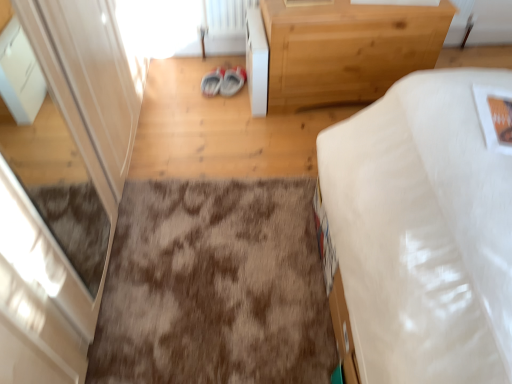
I want to click on brown shaggy rug at center, so click(214, 287).

What do you see at coordinates (93, 77) in the screenshot?
I see `white glossy screen door at left` at bounding box center [93, 77].

What do you see at coordinates (346, 49) in the screenshot?
I see `light wood/texture chest of drawers at upper right` at bounding box center [346, 49].

The width and height of the screenshot is (512, 384). I want to click on light wood/texture chest of drawers at upper right, so click(346, 49).

Describe the element at coordinates (256, 61) in the screenshot. This screenshot has height=384, width=512. I see `white glossy cabinet at upper center` at that location.

Where is `brown shaggy rug at center`? The image size is (512, 384). brown shaggy rug at center is located at coordinates (214, 287).

Could you tell me if matte gray sneakers at center is facing white glossy cabinet at upper center?

No, matte gray sneakers at center is not turned towards white glossy cabinet at upper center.

In terms of height, does matte gray sneakers at center look taller or shorter compared to white glossy cabinet at upper center?

Clearly, matte gray sneakers at center is shorter compared to white glossy cabinet at upper center.

Is matte gray sneakers at center smaller than white glossy cabinet at upper center?

Correct, matte gray sneakers at center occupies less space than white glossy cabinet at upper center.

Is there a large distance between matte gray sneakers at center and white glossy cabinet at upper center?

No, matte gray sneakers at center is not far away from white glossy cabinet at upper center.

In the scene shown: Between white glossy cabinet at upper center and white glossy screen door at left, which one has larger width?

white glossy cabinet at upper center.

Are white glossy cabinet at upper center and white glossy screen door at left beside each other?

white glossy cabinet at upper center and white glossy screen door at left are clearly separated.

From a real-world perspective, who is located higher, white glossy cabinet at upper center or white glossy screen door at left?

From a 3D spatial view, white glossy screen door at left is above.

From the image's perspective, is white glossy cabinet at upper center beneath white glossy screen door at left?

Actually, white glossy cabinet at upper center appears above white glossy screen door at left in the image.

Is light wood/texture chest of drawers at upper right inside the boundaries of brown shaggy rug at center, or outside?

light wood/texture chest of drawers at upper right is spatially situated outside brown shaggy rug at center.

Considering the relative sizes of light wood/texture chest of drawers at upper right and brown shaggy rug at center in the image provided, is light wood/texture chest of drawers at upper right shorter than brown shaggy rug at center?

No, light wood/texture chest of drawers at upper right is not shorter than brown shaggy rug at center.

Could you tell me if light wood/texture chest of drawers at upper right is turned towards brown shaggy rug at center?

Yes, light wood/texture chest of drawers at upper right is aimed at brown shaggy rug at center.

Is light wood/texture chest of drawers at upper right bigger or smaller than brown shaggy rug at center?

In the image, light wood/texture chest of drawers at upper right appears to be larger than brown shaggy rug at center.

Find the location of a particular element. This screenshot has width=512, height=384. footwear above the white glossy screen door at left (from the image's perspective) is located at coordinates (212, 82).

Would you say matte gray sneakers at center contains white glossy screen door at left?

No, white glossy screen door at left is not inside matte gray sneakers at center.

From the image's perspective, is matte gray sneakers at center above or below white glossy screen door at left?

matte gray sneakers at center is above white glossy screen door at left.

Which of these two, matte gray sneakers at center or white glossy screen door at left, stands shorter?

matte gray sneakers at center is shorter.

From the picture: Is white glossy screen door at left directly adjacent to matte gray sneakers at center?

white glossy screen door at left and matte gray sneakers at center are not in contact.

Which point is more forward, (109, 92) or (202, 90)?

Point (109, 92)

Which of these two, white glossy screen door at left or matte gray sneakers at center, is smaller?

Smaller between the two is matte gray sneakers at center.

You are a GUI agent. You are given a task and a screenshot of the screen. Output one action in this format:
    pyautogui.click(x=<x>, y=<y>)
    Task: Click on the cabinetry lying behind the brown shaggy rug at center
    
    Given the screenshot: What is the action you would take?
    pyautogui.click(x=256, y=61)

Is brown shaggy rug at center facing towards white glossy cabinet at upper center?

No, brown shaggy rug at center is not aimed at white glossy cabinet at upper center.

Is brown shaggy rug at center not close to white glossy cabinet at upper center?

Actually, brown shaggy rug at center and white glossy cabinet at upper center are a little close together.

Does brown shaggy rug at center appear on the left side of white glossy cabinet at upper center?

Indeed, brown shaggy rug at center is positioned on the left side of white glossy cabinet at upper center.

Which of these two, white glossy cabinet at upper center or light wood/texture chest of drawers at upper right, is bigger?

light wood/texture chest of drawers at upper right is bigger.

Measure the distance from white glossy cabinet at upper center to light wood/texture chest of drawers at upper right.

The distance of white glossy cabinet at upper center from light wood/texture chest of drawers at upper right is 11.85 inches.

Is light wood/texture chest of drawers at upper right at the back of white glossy cabinet at upper center?

No, light wood/texture chest of drawers at upper right is not at the back of white glossy cabinet at upper center.

Does point (261, 33) appear closer or farther from the camera than point (408, 36)?

Point (261, 33) appears to be farther away from the viewer than point (408, 36).

Identify the location of cabinetry above the matte gray sneakers at center (from a real-world perspective). This screenshot has height=384, width=512. (256, 61).

The height and width of the screenshot is (384, 512). Identify the location of cabinetry that is under the white glossy screen door at left (from a real-world perspective). click(256, 61).

Estimate the real-world distances between objects in this image. Which object is further from white glossy cabinet at upper center, white glossy screen door at left or light wood/texture chest of drawers at upper right?

Among the two, white glossy screen door at left is located further to white glossy cabinet at upper center.

Which object lies nearer to the anchor point light wood/texture chest of drawers at upper right, matte gray sneakers at center or white glossy screen door at left?

Among the two, matte gray sneakers at center is located nearer to light wood/texture chest of drawers at upper right.

Which object lies further to the anchor point matte gray sneakers at center, light wood/texture chest of drawers at upper right or white glossy cabinet at upper center?

The object further to matte gray sneakers at center is light wood/texture chest of drawers at upper right.

Considering their positions, is matte gray sneakers at center positioned further to white glossy screen door at left than light wood/texture chest of drawers at upper right?

light wood/texture chest of drawers at upper right is further to white glossy screen door at left.

When comparing their distances from matte gray sneakers at center, does brown shaggy rug at center or light wood/texture chest of drawers at upper right seem further?

brown shaggy rug at center is further to matte gray sneakers at center.

When comparing their distances from white glossy cabinet at upper center, does matte gray sneakers at center or brown shaggy rug at center seem further?

The object further to white glossy cabinet at upper center is brown shaggy rug at center.

When comparing their distances from white glossy screen door at left, does matte gray sneakers at center or white glossy cabinet at upper center seem closer?

Based on the image, white glossy cabinet at upper center appears to be nearer to white glossy screen door at left.

Looking at the image, which one is located further to white glossy cabinet at upper center, matte gray sneakers at center or white glossy screen door at left?

The object further to white glossy cabinet at upper center is white glossy screen door at left.

Find the location of `cabinetry between light wood/texture chest of drawers at upper right and brown shaggy rug at center vertically`. cabinetry between light wood/texture chest of drawers at upper right and brown shaggy rug at center vertically is located at coordinates (256, 61).

Find the location of a particular element. cabinetry situated between white glossy screen door at left and light wood/texture chest of drawers at upper right from left to right is located at coordinates (256, 61).

Locate an element on the screen. dirt between white glossy screen door at left and matte gray sneakers at center in the front-back direction is located at coordinates [x=214, y=287].

The width and height of the screenshot is (512, 384). I want to click on table between white glossy screen door at left and matte gray sneakers at center in the front-back direction, so (346, 49).